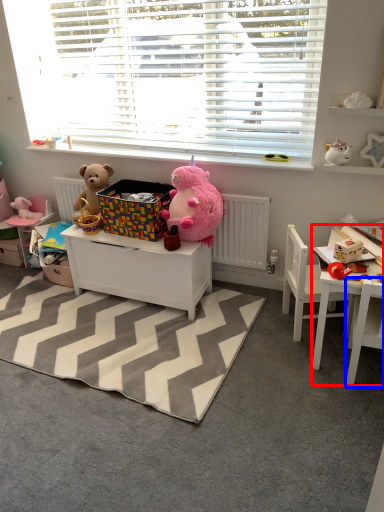
Question: Which object is closer to the camera taking this photo, table (highlighted by a red box) or chair (highlighted by a blue box)?

Choices:
 (A) table
 (B) chair

Answer: (B)